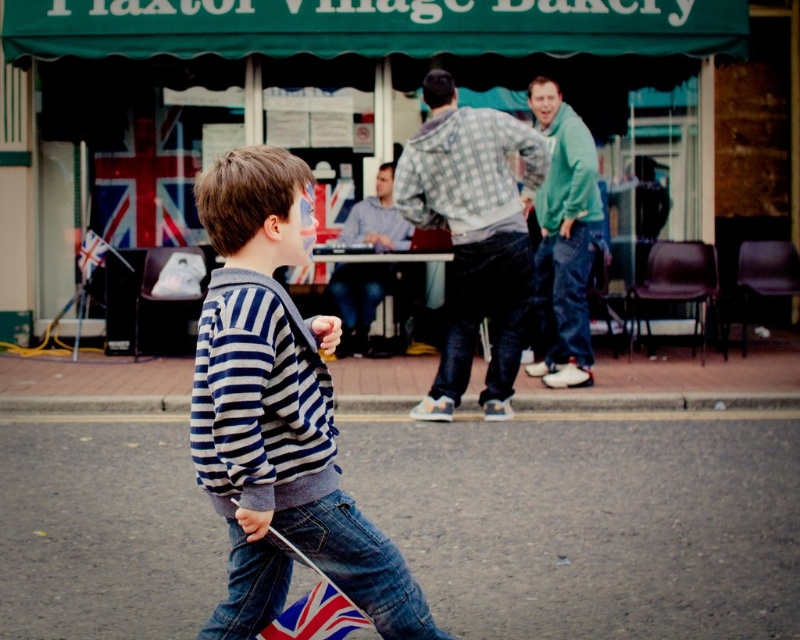
You are standing at the point with coordinates point (358,208) and want to walk to the point with coordinates point (494,342). Which direction should you walk to reach your destination?

You should walk forward because point (494,342) is in front of point (358,208).

What is the object located at the coordinates point (474, 236)?

The object located at point (474, 236) is the checkered fabric shirt at center.